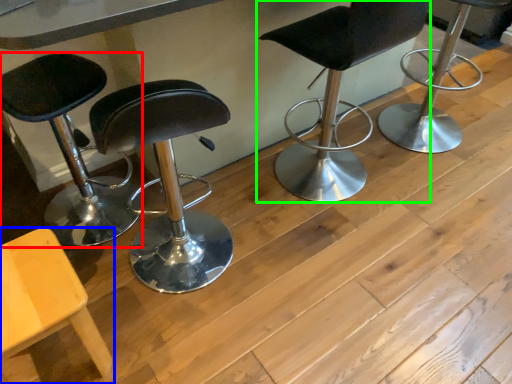
Question: Based on their relative distances, which object is farther from chair (highlighted by a red box)? Choose from chair (highlighted by a blue box) and chair (highlighted by a green box).

Choices:
 (A) chair
 (B) chair

Answer: (B)